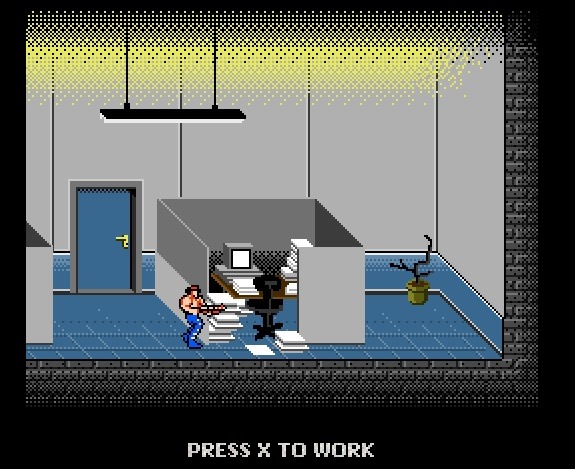
The height and width of the screenshot is (469, 575). I want to click on light hanging from ceiling, so click(117, 120), click(189, 120), click(222, 121).